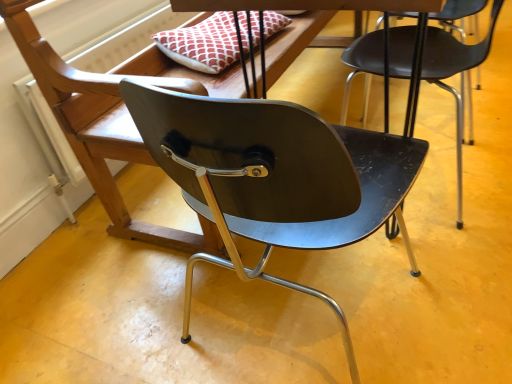
Identify the location of free space below matte black chair at center, which ranks as the first chair in right-to-left order (from a real-world perspective). The image size is (512, 384). (442, 177).